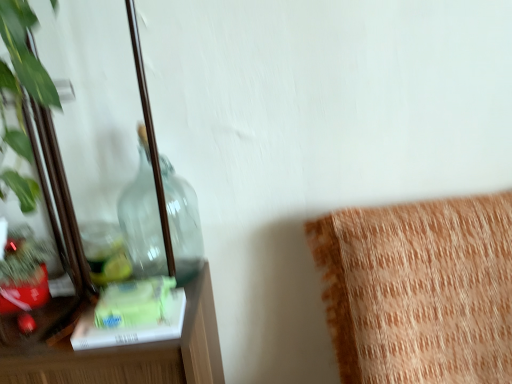
Question: In terms of size, does orange textured cushion at upper right appear bigger or smaller than transparent glass bottle at left?

Choices:
 (A) big
 (B) small

Answer: (A)

Question: In the image, is orange textured cushion at upper right positioned in front of or behind transparent glass bottle at left?

Choices:
 (A) behind
 (B) front

Answer: (B)

Question: Which object is positioned closest to the transparent glass bottle at left?

Choices:
 (A) clear glass mirror at left
 (B) orange textured cushion at upper right

Answer: (A)

Question: Which object is positioned closest to the orange textured cushion at upper right?

Choices:
 (A) clear glass mirror at left
 (B) transparent glass bottle at left

Answer: (B)